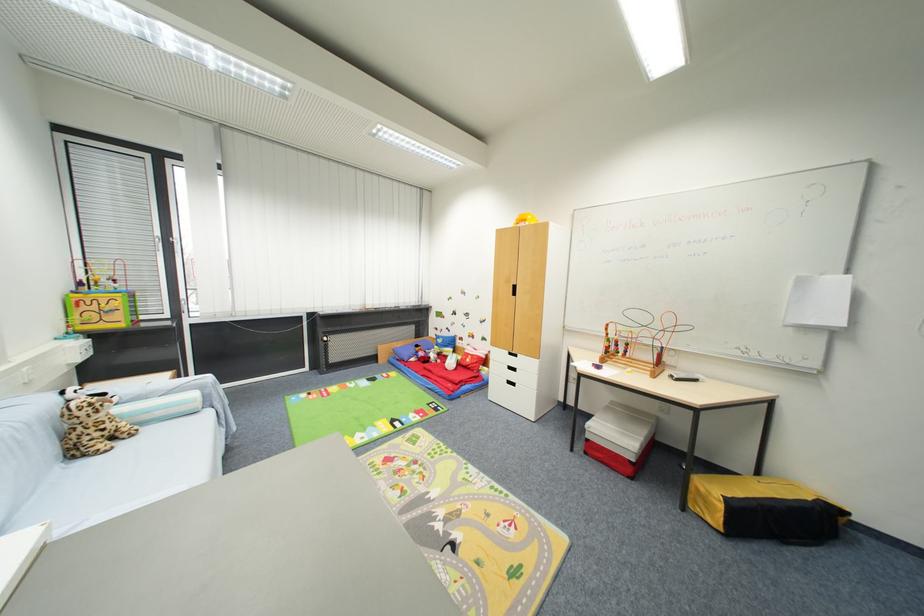
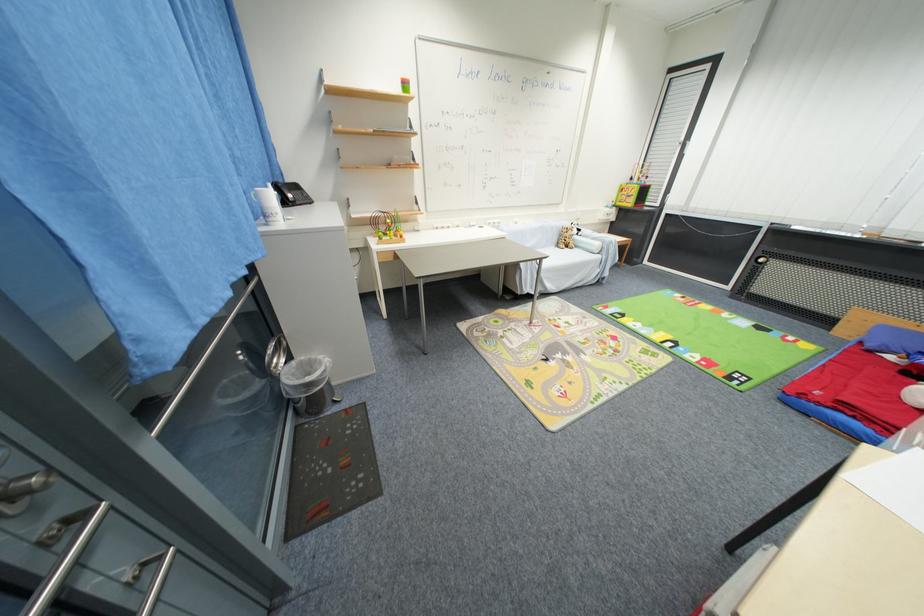
In the second image, find the point that corresponds to (125,446) in the first image.

(572, 251)